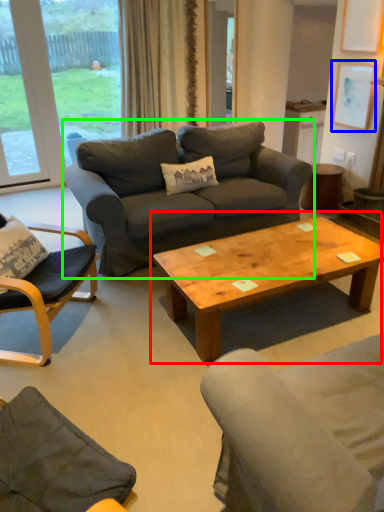
Question: Considering the real-world distances, which object is closest to coffee table (highlighted by a red box)? picture frame (highlighted by a blue box) or studio couch (highlighted by a green box).

Choices:
 (A) picture frame
 (B) studio couch

Answer: (B)